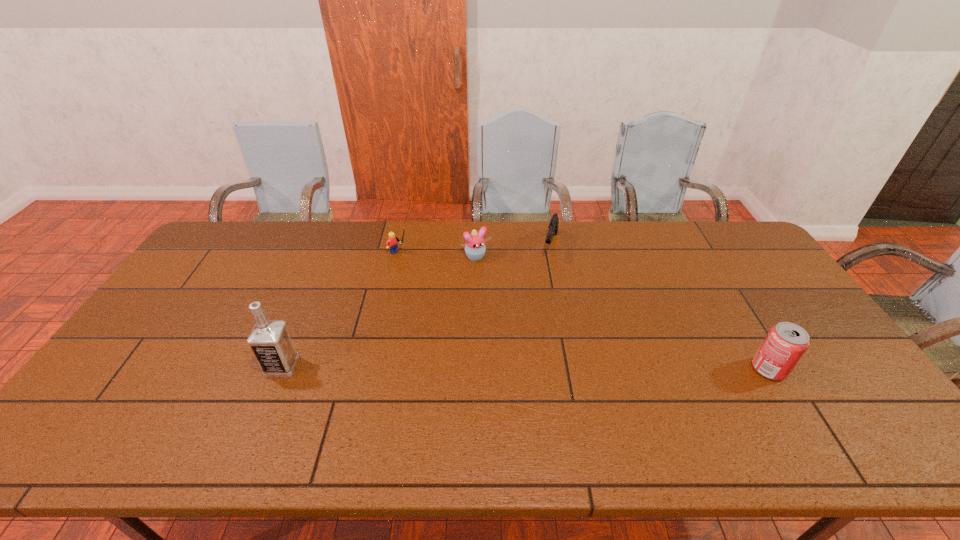
Find the location of `object that is the fourth closest one to the vodka`. object that is the fourth closest one to the vodka is located at coordinates (785, 343).